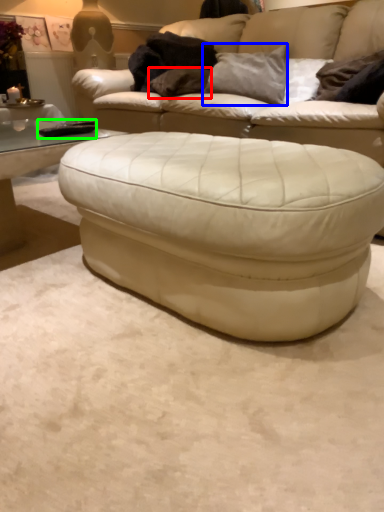
Question: Which is farther away from pillow (highlighted by a red box)? pillow (highlighted by a blue box) or pad (highlighted by a green box)?

Choices:
 (A) pillow
 (B) pad

Answer: (B)